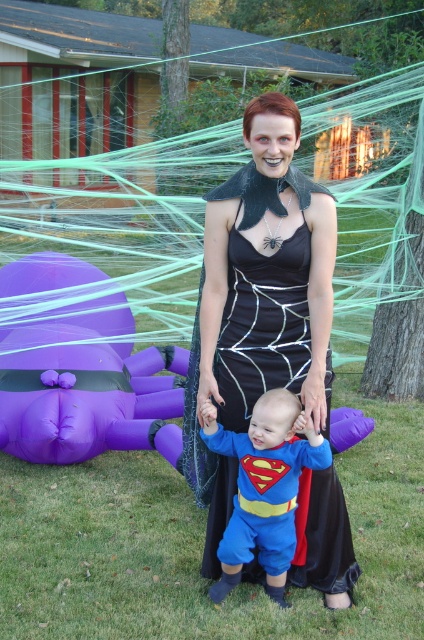
You are a delivery person who needs to place a package between the black matte dress at center and the purple inflatable spider at lower left. Can you fit the package, which is 5 feet long, between them?

The distance between the black matte dress at center and the purple inflatable spider at lower left is 4.84 feet, so the 5 feet long package cannot fit between them as it is slightly longer than the available space.